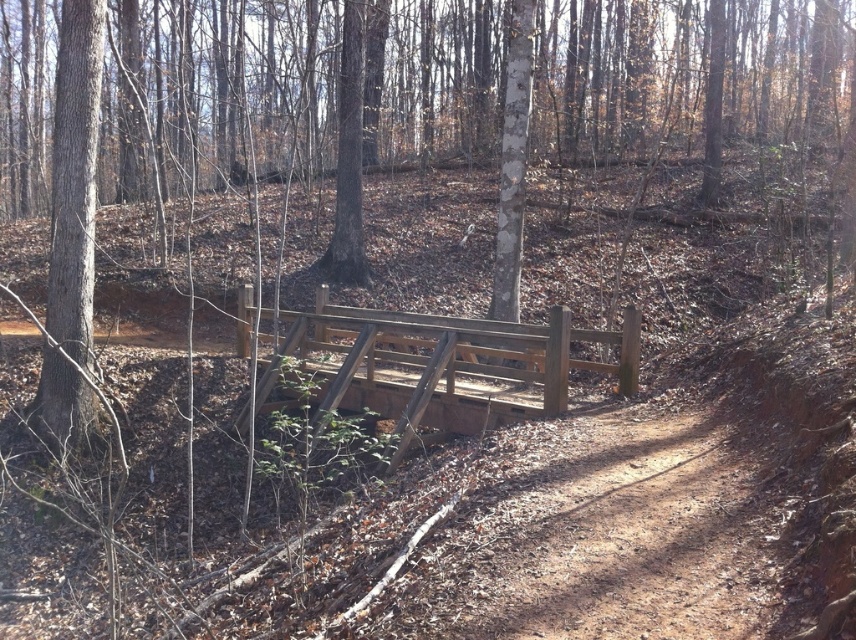
Question: Which point is closer to the camera taking this photo?

Choices:
 (A) (82, 186)
 (B) (342, 12)

Answer: (A)

Question: Is smooth brown tree trunk at left thinner than smooth brown tree at center?

Choices:
 (A) no
 (B) yes

Answer: (A)

Question: Does smooth brown tree trunk at left lie in front of smooth brown tree at center?

Choices:
 (A) no
 (B) yes

Answer: (B)

Question: Which object is farther from the camera taking this photo?

Choices:
 (A) smooth brown tree at center
 (B) smooth brown tree trunk at left

Answer: (A)

Question: Does smooth brown tree trunk at left have a larger size compared to smooth brown tree at center?

Choices:
 (A) yes
 (B) no

Answer: (A)